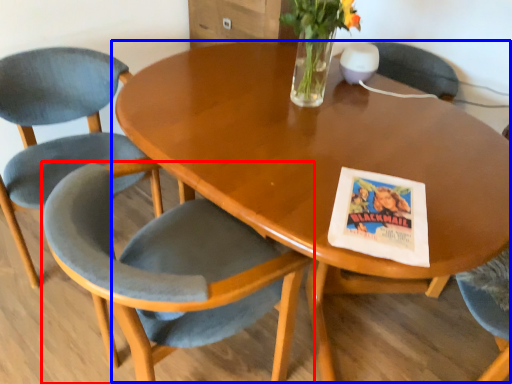
Question: Which of the following is the closest to the observer, chair (highlighted by a red box) or coffee table (highlighted by a blue box)?

Choices:
 (A) chair
 (B) coffee table

Answer: (A)